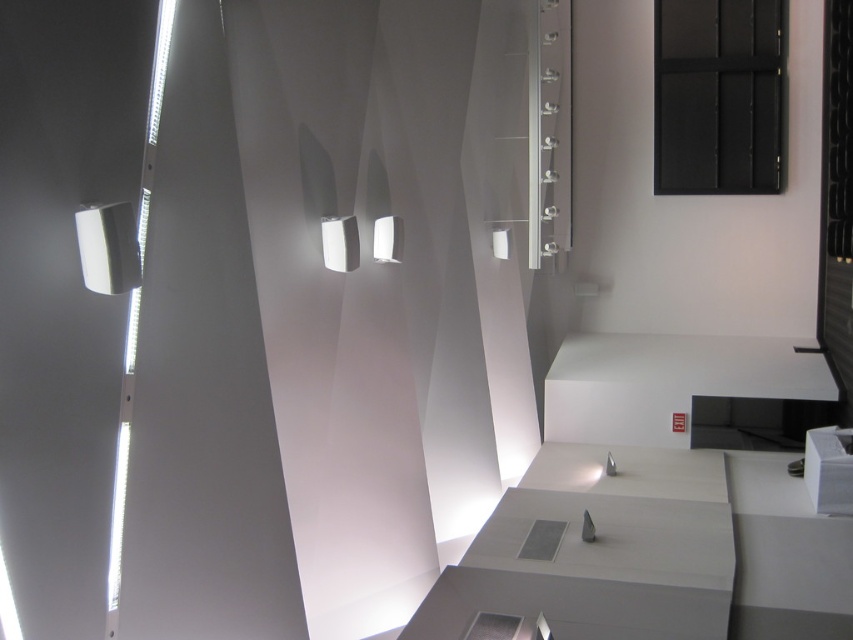
You are an interior designer planning to install a new light fixture in this room. You have two options available for placement near the center area. The first option is the white glossy rectangular light at center, and the second is the white glossy light at center. According to the description, how far apart are these two lights from each other?

The white glossy rectangular light at center is 19.04 inches away from the white glossy light at center.

You are an interior designer planning to install a new light fixture in this room. You have two options to choose from. The first is the white glossy wall sconce at upper left, and the second is the white glossy light at center. Based on their widths, which one would you recommend if you need a fixture that occupies more horizontal space?

The white glossy wall sconce at upper left might be wider than the white glossy light at center, so it would be the better choice if you need a fixture that occupies more horizontal space.

You are standing in the room and want to install a new light fixture between the white glossy wall sconce at upper left and the white glossy rectangular light at center. Based on their positions, which side should the new fixture be placed to maintain symmetry?

The white glossy wall sconce at upper left is to the left of white glossy rectangular light at center, so placing the new fixture between them would require positioning it to the right of the wall sconce and to the left of the rectangular light to maintain symmetry.